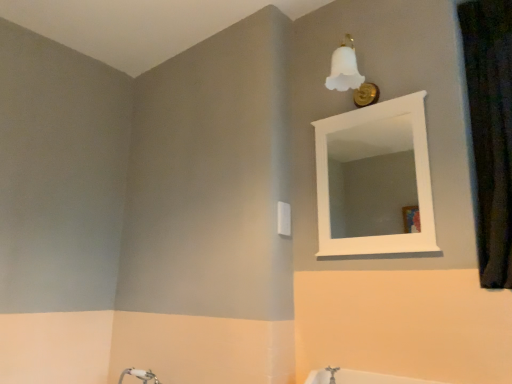
Measure the distance between point (511,184) and camera.

A distance of 4.76 feet exists between point (511,184) and camera.

Image resolution: width=512 pixels, height=384 pixels. Find the location of `black textured curtain at right`. black textured curtain at right is located at coordinates (490, 130).

What do you see at coordinates (490, 130) in the screenshot?
I see `black textured curtain at right` at bounding box center [490, 130].

This screenshot has height=384, width=512. I want to click on white wooden mirror at upper center, so click(x=372, y=179).

Describe the element at coordinates (372, 179) in the screenshot. I see `white wooden mirror at upper center` at that location.

What is the approximate height of white wooden mirror at upper center?

It is 23.86 inches.

Measure the distance between white wooden mirror at upper center and camera.

white wooden mirror at upper center is 11.56 feet from camera.

Find the location of a particular element. The image size is (512, 384). black textured curtain at right is located at coordinates (490, 130).

Considering the positions of objects white wooden mirror at upper center and black textured curtain at right in the image provided, who is more to the right, white wooden mirror at upper center or black textured curtain at right?

Positioned to the right is black textured curtain at right.

Does white wooden mirror at upper center come in front of black textured curtain at right?

No, the depth of white wooden mirror at upper center is greater than that of black textured curtain at right.

Does point (333, 229) appear closer or farther from the camera than point (480, 243)?

Point (333, 229) is positioned farther from the camera compared to point (480, 243).

From the image's perspective, is white wooden mirror at upper center above black textured curtain at right?

No, from the image's perspective, white wooden mirror at upper center is not on top of black textured curtain at right.

From a real-world perspective, is white wooden mirror at upper center located beneath black textured curtain at right?

Yes, from a real-world perspective, white wooden mirror at upper center is under black textured curtain at right.

Considering the sizes of objects white wooden mirror at upper center and black textured curtain at right in the image provided, who is wider, white wooden mirror at upper center or black textured curtain at right?

With larger width is black textured curtain at right.

Is white wooden mirror at upper center taller than black textured curtain at right?

In fact, white wooden mirror at upper center may be shorter than black textured curtain at right.

Who is bigger, white wooden mirror at upper center or black textured curtain at right?

black textured curtain at right is bigger.

Does white wooden mirror at upper center contain black textured curtain at right?

Actually, black textured curtain at right is outside white wooden mirror at upper center.

Is white wooden mirror at upper center far away from black textured curtain at right?

That's right, there is a large distance between white wooden mirror at upper center and black textured curtain at right.

Is white wooden mirror at upper center facing away from black textured curtain at right?

No, white wooden mirror at upper center is not facing the opposite direction of black textured curtain at right.

Can you tell me how much white wooden mirror at upper center and black textured curtain at right differ in facing direction?

The angular difference between white wooden mirror at upper center and black textured curtain at right is 2.19 degrees.

Locate an element on the screen. The height and width of the screenshot is (384, 512). mirror on the left of the black textured curtain at right is located at coordinates (372, 179).

Considering the relative positions of black textured curtain at right and white wooden mirror at upper center in the image provided, is black textured curtain at right to the left or to the right of white wooden mirror at upper center?

In the image, black textured curtain at right appears on the right side of white wooden mirror at upper center.

Does black textured curtain at right come in front of white wooden mirror at upper center?

Yes, black textured curtain at right is closer to the viewer.

Is point (485, 287) more distant than point (365, 162)?

No, (485, 287) is in front of (365, 162).

From the image's perspective, which one is positioned lower, black textured curtain at right or white wooden mirror at upper center?

white wooden mirror at upper center appears lower in the image.

From a real-world perspective, is black textured curtain at right positioned over white wooden mirror at upper center based on gravity?

Yes.

Is black textured curtain at right wider than white wooden mirror at upper center?

Indeed, black textured curtain at right has a greater width compared to white wooden mirror at upper center.

Considering the sizes of objects black textured curtain at right and white wooden mirror at upper center in the image provided, who is shorter, black textured curtain at right or white wooden mirror at upper center?

white wooden mirror at upper center is shorter.

Does black textured curtain at right have a larger size compared to white wooden mirror at upper center?

Correct, black textured curtain at right is larger in size than white wooden mirror at upper center.

Is black textured curtain at right not inside white wooden mirror at upper center?

black textured curtain at right is positioned outside white wooden mirror at upper center.

Is black textured curtain at right in contact with white wooden mirror at upper center?

No.

Is black textured curtain at right oriented towards white wooden mirror at upper center?

No, black textured curtain at right does not turn towards white wooden mirror at upper center.

Consider the image. Can you tell me how much black textured curtain at right and white wooden mirror at upper center differ in facing direction?

There is a 2.19-degree angle between the facing directions of black textured curtain at right and white wooden mirror at upper center.

Locate an element on the screen. curtain above the white wooden mirror at upper center (from a real-world perspective) is located at coordinates (490, 130).

Locate an element on the screen. The height and width of the screenshot is (384, 512). curtain in front of the white wooden mirror at upper center is located at coordinates pos(490,130).

Locate an element on the screen. curtain that is above the white wooden mirror at upper center (from the image's perspective) is located at coordinates (490, 130).